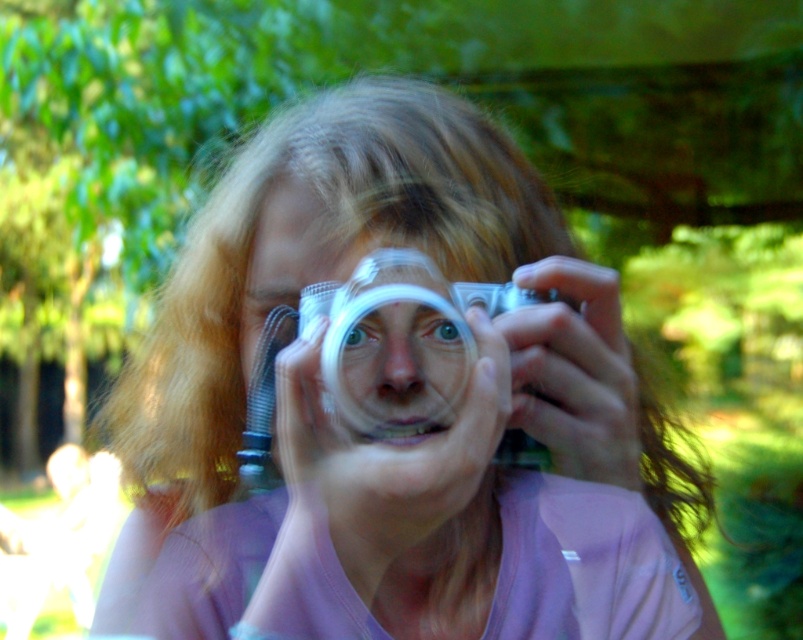
Is matte silver camera at center above matte plastic face at center?

Incorrect, matte silver camera at center is not positioned above matte plastic face at center.

The image size is (803, 640). I want to click on matte silver camera at center, so click(398, 401).

From the picture: Which is below, blue glossy eye at center or green matte eye at center?

Positioned lower is green matte eye at center.

Between blue glossy eye at center and green matte eye at center, which one has more height?

With more height is green matte eye at center.

The image size is (803, 640). Find the location of `blue glossy eye at center`. blue glossy eye at center is located at coordinates (442, 332).

Can you confirm if matte silver camera at center is wider than green matte eye at center?

Yes, matte silver camera at center is wider than green matte eye at center.

Who is more distant from viewer, (276,292) or (367,330)?

Positioned behind is point (276,292).

Where is `matte silver camera at center`? matte silver camera at center is located at coordinates (398, 401).